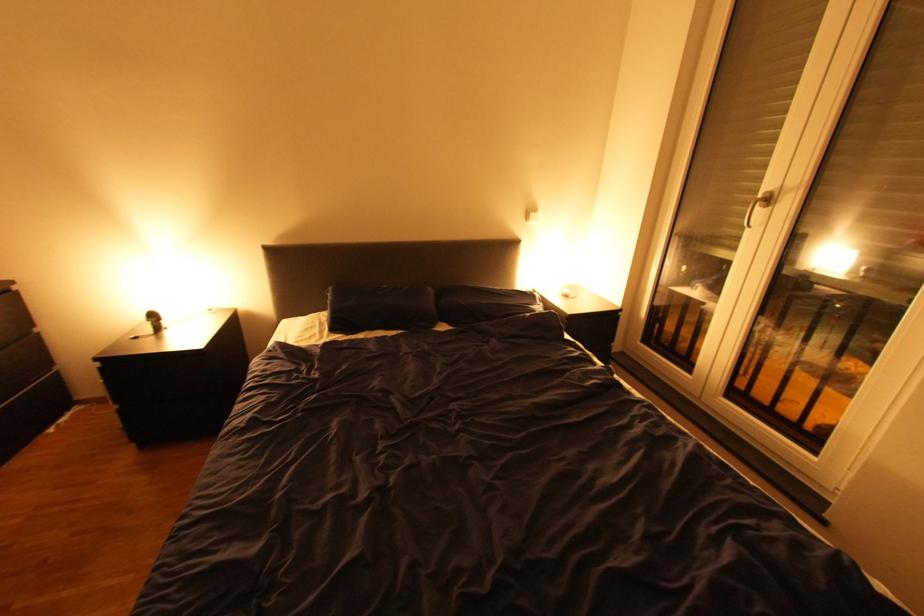
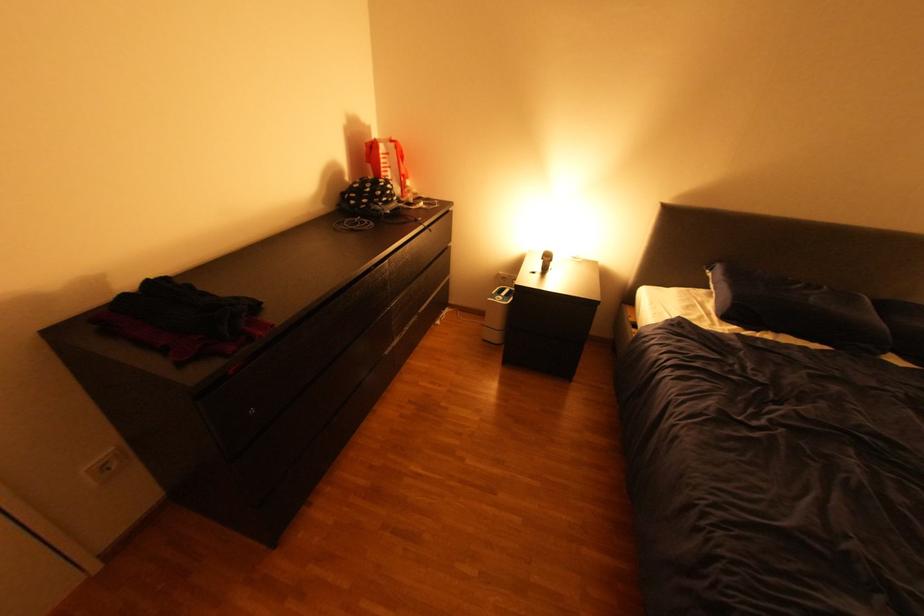
Find the pixel in the second image that matches point (348, 334) in the first image.

(745, 326)